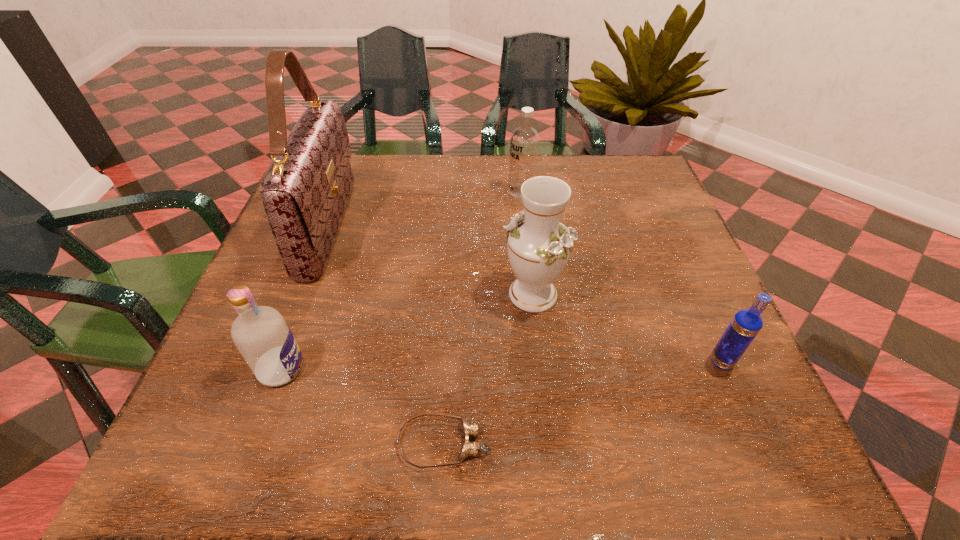
The width and height of the screenshot is (960, 540). What are the coordinates of `handbag` in the screenshot? It's located at (305, 191).

Identify the location of vase. (539, 246).

The height and width of the screenshot is (540, 960). Identify the location of the farthest vodka. (525, 140).

What are the coordinates of `the leftmost vodka` in the screenshot? It's located at (264, 339).

At what (x,y) coordinates should I click in order to perform the action: click on the rightmost object. Please return your answer as a coordinate pair (x, y). The height and width of the screenshot is (540, 960). Looking at the image, I should click on (746, 324).

Find the location of `the shortest vodka`. the shortest vodka is located at coordinates (746, 324).

The image size is (960, 540). I want to click on the third object from left to right, so click(x=470, y=430).

Where is `the shortest object`? The width and height of the screenshot is (960, 540). the shortest object is located at coordinates (470, 430).

You are a GUI agent. You are given a task and a screenshot of the screen. Output one action in this format:
    pyautogui.click(x=<x>, y=<y>)
    Task: Click on the vacant area situated 0.120m on the front of the handbag with the clasp
    
    Given the screenshot: What is the action you would take?
    pyautogui.click(x=398, y=226)

Find the location of a particular element. vacant space located on the front of the vase is located at coordinates (544, 399).